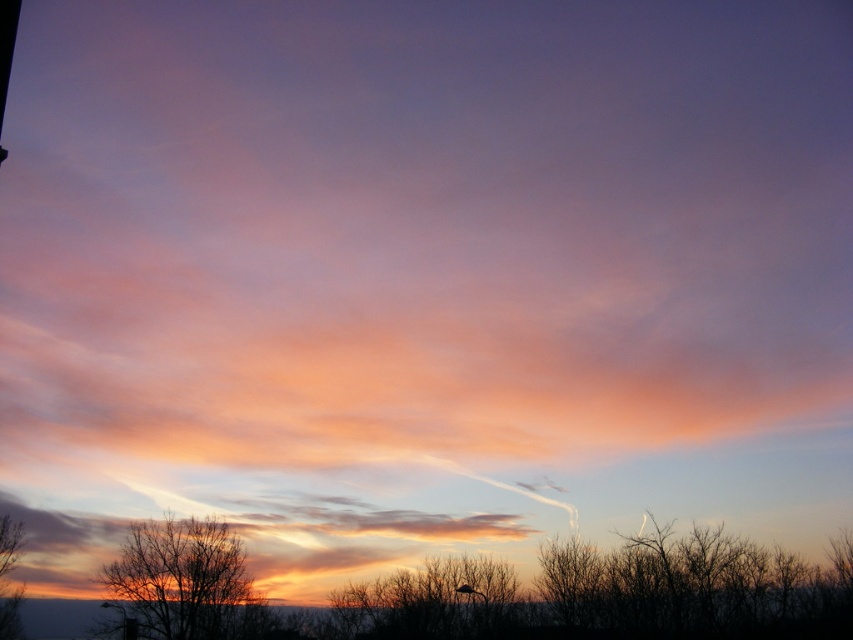
Does silhouette bare tree at lower left appear on the right side of brown matte tree at lower left?

Correct, you'll find silhouette bare tree at lower left to the right of brown matte tree at lower left.

Does silhouette bare tree at lower left appear over brown matte tree at lower left?

Incorrect, silhouette bare tree at lower left is not positioned above brown matte tree at lower left.

Identify the location of silhouette bare tree at lower left. (183, 580).

Image resolution: width=853 pixels, height=640 pixels. In order to click on silhouette bare tree at lower left in this screenshot , I will do `click(183, 580)`.

Is point (236, 497) less distant than point (7, 528)?

No, it is not.

Which is in front, point (45, 538) or point (6, 545)?

Point (6, 545) is more forward.

Locate an element on the screen. The width and height of the screenshot is (853, 640). translucent white cloud at center is located at coordinates coord(248,536).

How distant is translucent white cloud at center from silhouette bare tree at lower left?

translucent white cloud at center and silhouette bare tree at lower left are 48.55 feet apart.

Is translucent white cloud at center wider than silhouette bare tree at lower left?

Yes.

Is point (167, 500) positioned before point (192, 548)?

No, (167, 500) is further to viewer.

The image size is (853, 640). I want to click on translucent white cloud at center, so click(x=248, y=536).